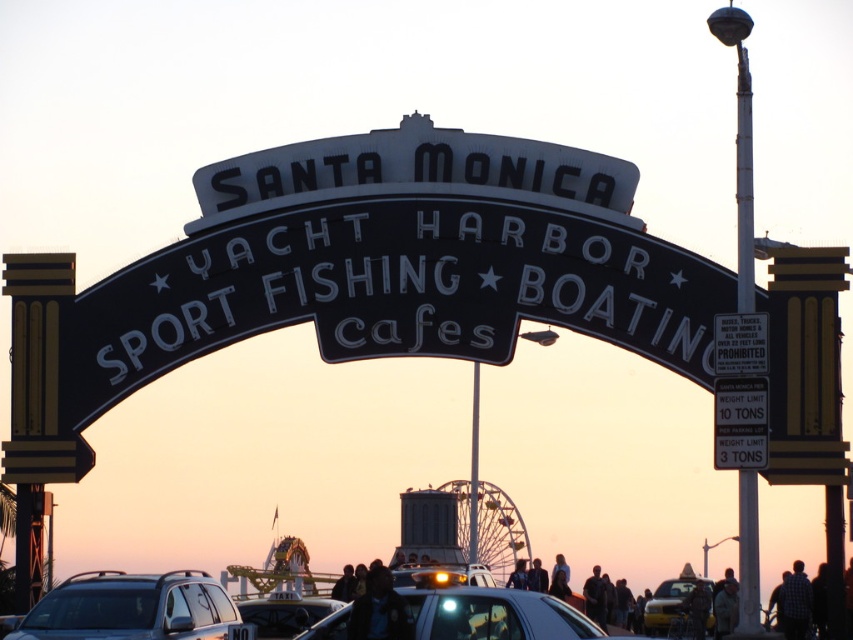
You are a tourist driving a car and want to park near the Santa Monica Pier. You see the image and notice a silver metallic suv at center and a shiny silver car at center. Which vehicle takes up more space in the parking spot?

The silver metallic suv at center has a larger size compared to the shiny silver car at center, so it takes up more space in the parking spot.